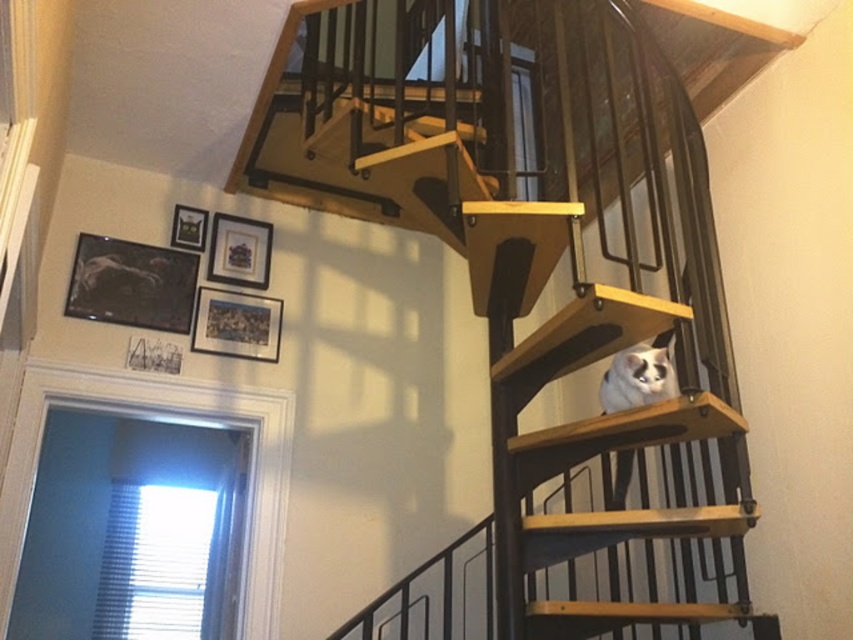
Question: Is wooden stairs at center further to the viewer compared to white fur cat at upper right?

Choices:
 (A) no
 (B) yes

Answer: (A)

Question: Is wooden stairs at center positioned in front of white fur cat at upper right?

Choices:
 (A) yes
 (B) no

Answer: (A)

Question: Which object is farther from the camera taking this photo?

Choices:
 (A) white fur cat at upper right
 (B) wooden stairs at center

Answer: (A)

Question: Can you confirm if wooden stairs at center is bigger than white fur cat at upper right?

Choices:
 (A) no
 (B) yes

Answer: (B)

Question: Which point is farther to the camera?

Choices:
 (A) (669, 188)
 (B) (613, 364)

Answer: (A)